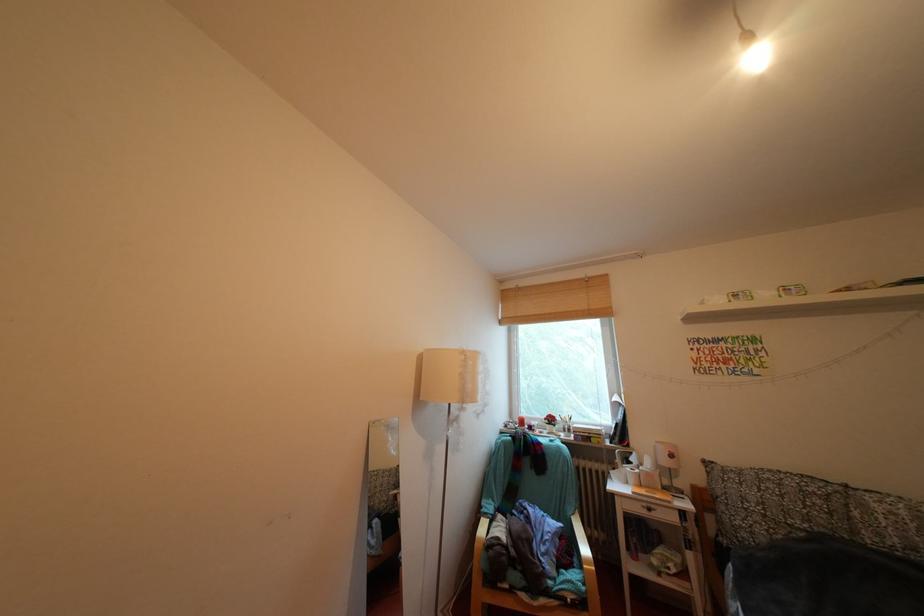
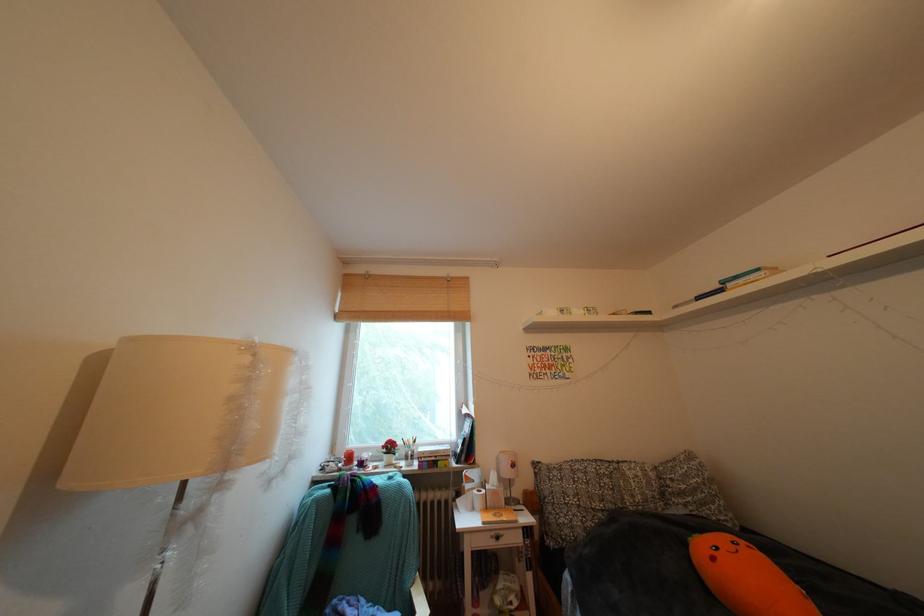
Question: The images are taken continuously from a first-person perspective. In which direction is your viewpoint rotating?

Choices:
 (A) Left
 (B) Right
 (C) Up
 (D) Down

Answer: (B)